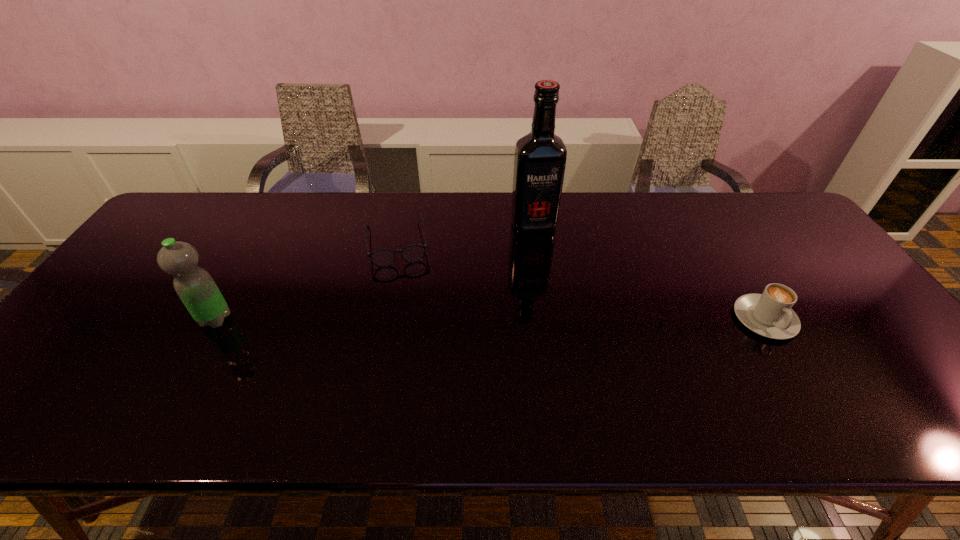
This screenshot has height=540, width=960. I want to click on vacant space located on the front-facing side of the spectacles, so click(416, 370).

At what (x,y) coordinates should I click in order to perform the action: click on free spot located on the front-facing side of the spectacles. Please return your answer as a coordinate pair (x, y). Looking at the image, I should click on (415, 363).

You are a GUI agent. You are given a task and a screenshot of the screen. Output one action in this format:
    pyautogui.click(x=<x>, y=<y>)
    Task: Click on the blank area located on the front-facing side of the spectacles
    
    Given the screenshot: What is the action you would take?
    pyautogui.click(x=407, y=312)

I want to click on vacant space located on the front-facing side of the liquor, so click(x=564, y=319).

The height and width of the screenshot is (540, 960). Find the location of `vacant space positioned 0.210m on the front-facing side of the liquor`. vacant space positioned 0.210m on the front-facing side of the liquor is located at coordinates (554, 285).

The height and width of the screenshot is (540, 960). What are the coordinates of `vacant space situated 0.380m on the front-facing side of the liquor` in the screenshot? It's located at (570, 334).

Where is `spectacles that is at the far edge`? This screenshot has height=540, width=960. spectacles that is at the far edge is located at coordinates (413, 253).

This screenshot has width=960, height=540. What are the coordinates of `liquor that is at the far edge` in the screenshot? It's located at (540, 157).

The image size is (960, 540). In the image, there is a desktop. Find the location of `free space at the far edge`. free space at the far edge is located at coordinates (593, 191).

The height and width of the screenshot is (540, 960). In the image, there is a desktop. What are the coordinates of `blank space at the near edge` in the screenshot? It's located at (241, 373).